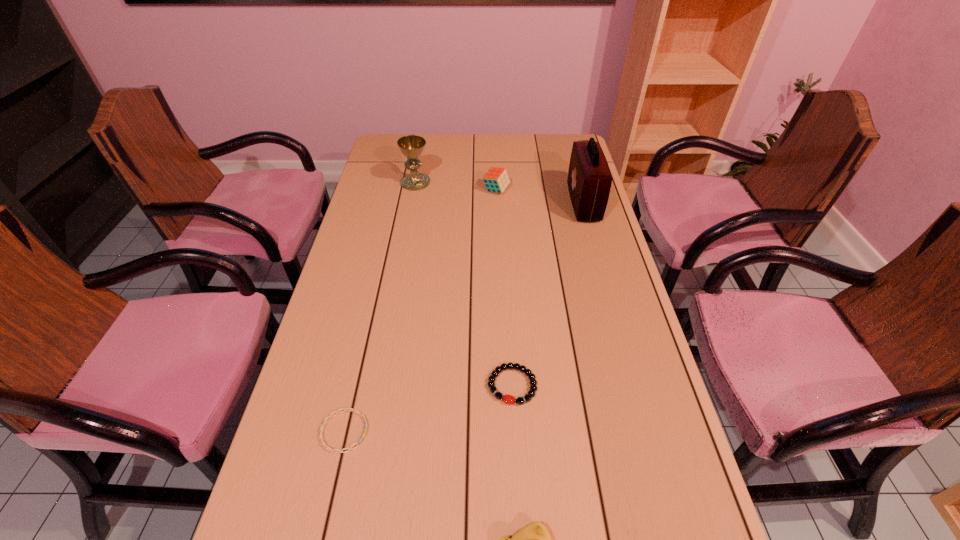
This screenshot has height=540, width=960. I want to click on the rightmost object, so click(x=589, y=181).

In order to click on the tallest object in this screenshot , I will do `click(589, 181)`.

You are a GUI agent. You are given a task and a screenshot of the screen. Output one action in this format:
    pyautogui.click(x=<x>, y=<y>)
    Task: Click on the chalice
    The height and width of the screenshot is (540, 960).
    Given the screenshot: What is the action you would take?
    pyautogui.click(x=411, y=146)

Locate an element on the screen. Image resolution: width=960 pixels, height=540 pixels. cube is located at coordinates (496, 180).

Find the location of a particular element. This screenshot has height=540, width=960. the second shortest object is located at coordinates (509, 399).

Where is `the third nearest object`? The height and width of the screenshot is (540, 960). the third nearest object is located at coordinates (509, 399).

The image size is (960, 540). I want to click on the shorter bracelet, so click(x=345, y=409).

Where is `the nearer bracelet`? The width and height of the screenshot is (960, 540). the nearer bracelet is located at coordinates (345, 409).

I want to click on free space located on the side of the tallest object with the cross symbol, so click(547, 203).

This screenshot has height=540, width=960. I want to click on blank space located on the side of the tallest object with the cross symbol, so click(x=555, y=203).